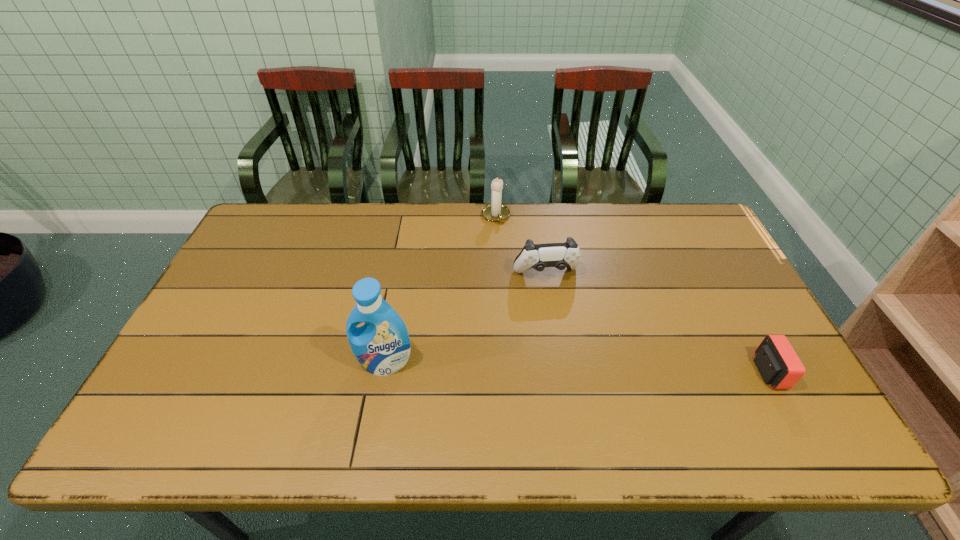
Where is `the tallest object`? The width and height of the screenshot is (960, 540). the tallest object is located at coordinates (382, 346).

Identify the location of detergent. (382, 346).

The image size is (960, 540). What are the coordinates of `the rightmost object` in the screenshot? It's located at (775, 359).

This screenshot has width=960, height=540. I want to click on alarm clock, so click(x=775, y=359).

You are a GUI agent. You are given a task and a screenshot of the screen. Output one action in this format:
    pyautogui.click(x=<x>, y=<y>)
    Task: Click on the control
    This screenshot has width=960, height=540.
    Given the screenshot: What is the action you would take?
    pyautogui.click(x=559, y=255)

Image resolution: width=960 pixels, height=540 pixels. Identify the location of the third nearest object. (559, 255).

Identify the location of the third shortest object. (496, 212).

Locate an element on the screen. the farthest object is located at coordinates (496, 212).

Where is `vacant region located 0.060m on the front-facing side of the leftmost object`? vacant region located 0.060m on the front-facing side of the leftmost object is located at coordinates (379, 397).

I want to click on free space located 0.160m on the front-facing side of the third nearest object, so (563, 326).